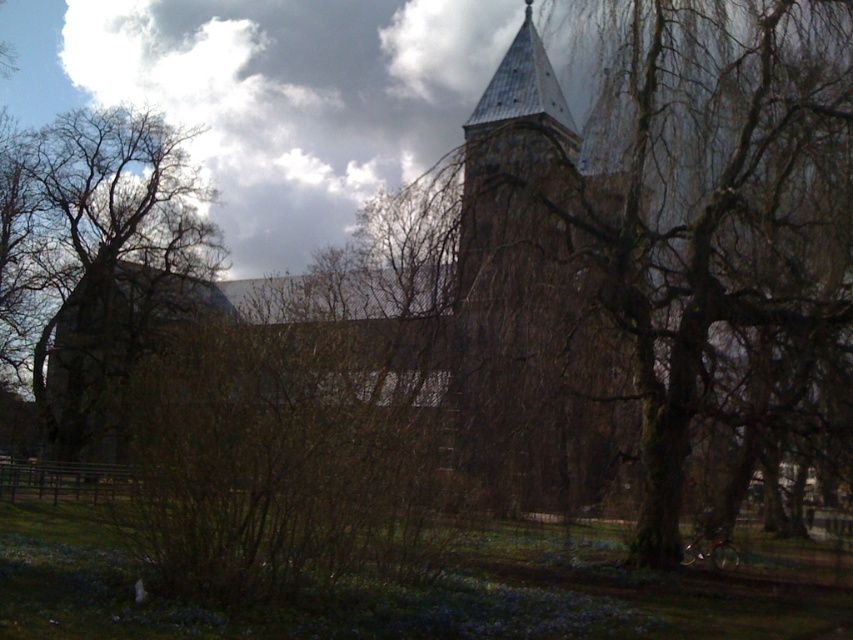
Between point (782, 125) and point (105, 132), which one is positioned in front?

Point (782, 125) is in front.

What do you see at coordinates (701, 205) in the screenshot? I see `brown bark tree at center` at bounding box center [701, 205].

Where is `brown bark tree at center`? brown bark tree at center is located at coordinates (701, 205).

Which of these two, brown bark tree at center or brown textured bush at center, stands taller?

brown bark tree at center is taller.

Is brown bark tree at center thinner than brown textured bush at center?

No, brown bark tree at center is not thinner than brown textured bush at center.

Identify the location of brown bark tree at center. (701, 205).

Is brown textured bush at center wider than brown rough bark tree at left?

No.

What do you see at coordinates (292, 452) in the screenshot?
I see `brown textured bush at center` at bounding box center [292, 452].

The height and width of the screenshot is (640, 853). Find the location of `brown textured bush at center`. brown textured bush at center is located at coordinates (292, 452).